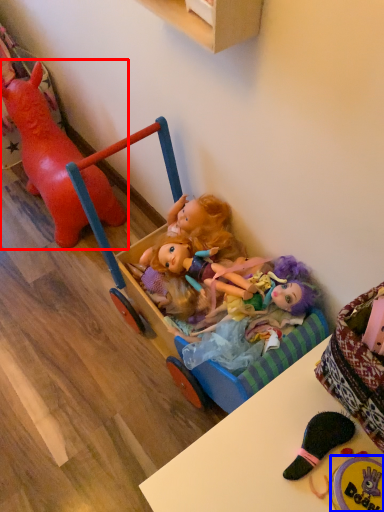
Question: Which object appears farthest to the camera in this image, toy (highlighted by a red box) or toy (highlighted by a blue box)?

Choices:
 (A) toy
 (B) toy

Answer: (A)